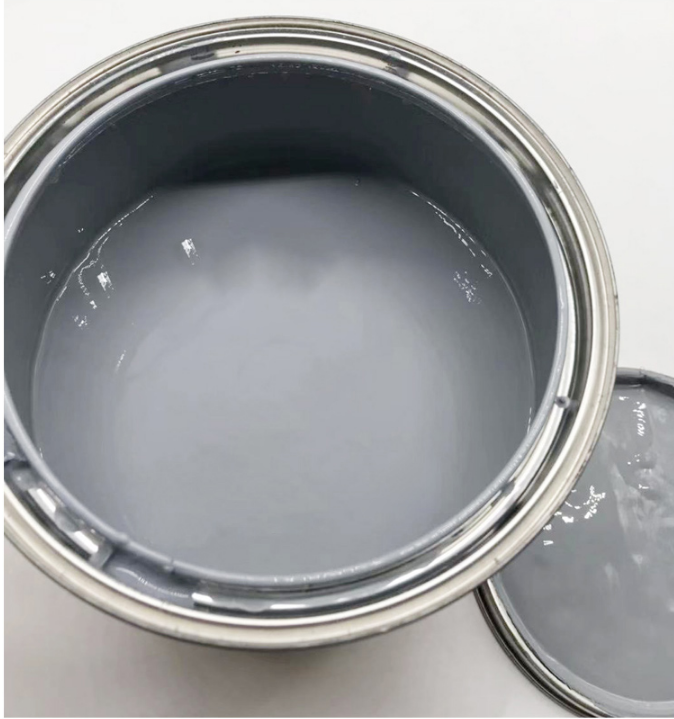
Locate an element on the screen. This screenshot has height=719, width=674. gray paint is located at coordinates (486, 318).